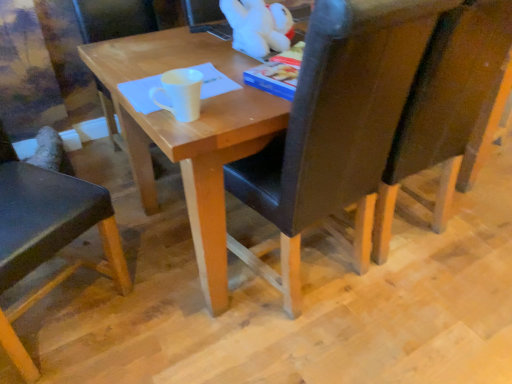
The width and height of the screenshot is (512, 384). Identify the location of vacant space to the left of white plush toy at upper center. (204, 54).